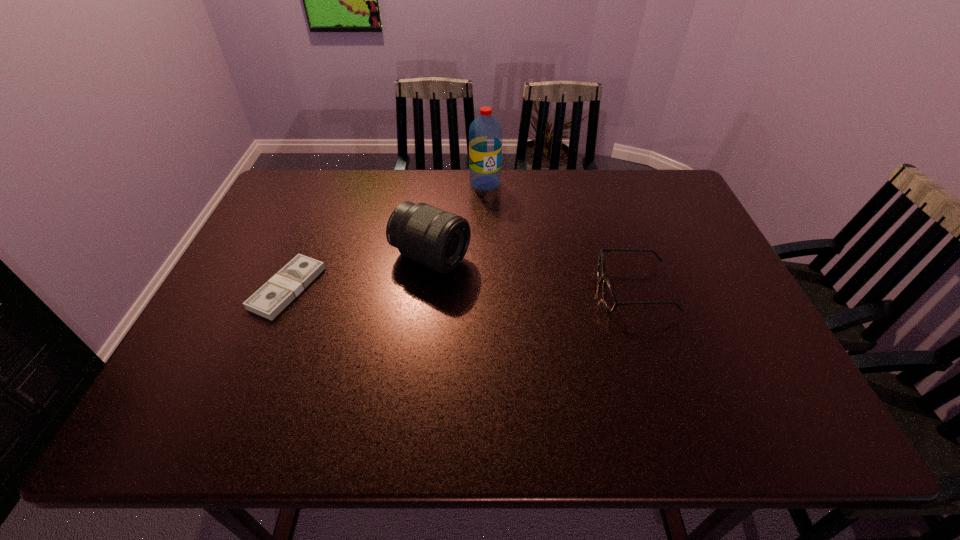
Identify the location of blank space at the near edge of the desktop. (497, 382).

In the image, there is a desktop. At what (x,y) coordinates should I click in order to perform the action: click on vacant space at the left edge. Please return your answer as a coordinate pair (x, y). Image resolution: width=960 pixels, height=540 pixels. Looking at the image, I should click on (220, 333).

Where is `vacant space at the right edge`? vacant space at the right edge is located at coordinates (768, 340).

Locate an element on the screen. blank space at the far right corner of the desktop is located at coordinates (652, 207).

The image size is (960, 540). In order to click on free space that is in between the leftmost object and the second shortest object in this screenshot , I will do `click(461, 289)`.

Image resolution: width=960 pixels, height=540 pixels. I want to click on vacant area that lies between the leftmost object and the rightmost object, so click(461, 289).

This screenshot has width=960, height=540. In order to click on empty space that is in between the spectacles and the second tallest object in this screenshot , I will do `click(533, 274)`.

Find the location of a particular element. Image resolution: width=960 pixels, height=540 pixels. free space between the farthest object and the third tallest object is located at coordinates (560, 237).

Find the location of a particular element. The image size is (960, 540). unoccupied position between the second tallest object and the rightmost object is located at coordinates (533, 274).

Locate an element on the screen. This screenshot has height=540, width=960. vacant space that is in between the spectacles and the dollar is located at coordinates pyautogui.click(x=461, y=289).